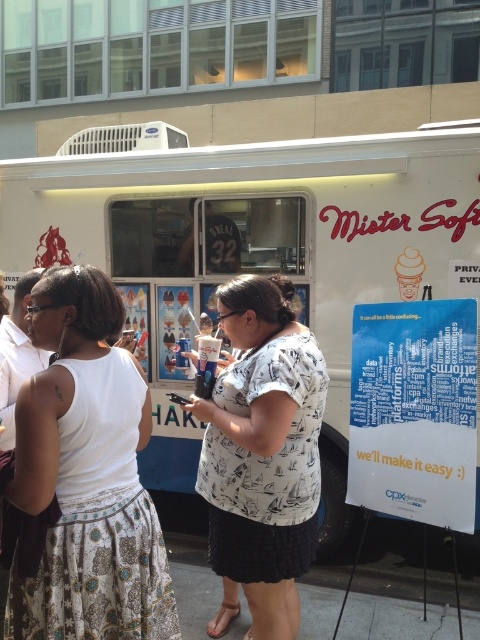
Question: Based on their relative distances, which object is farther from the white printed blouse at center?

Choices:
 (A) white printed shirt at center
 (B) white matte food truck at center

Answer: (B)

Question: Does white matte food truck at center appear over white printed shirt at center?

Choices:
 (A) yes
 (B) no

Answer: (A)

Question: Does white matte food truck at center appear under white printed blouse at center?

Choices:
 (A) no
 (B) yes

Answer: (A)

Question: Among these points, which one is nearest to the camera?

Choices:
 (A) (98, 385)
 (B) (295, 163)

Answer: (A)

Question: Which point appears closest to the camera in this image?

Choices:
 (A) (260, 195)
 (B) (181, 406)
 (C) (75, 448)

Answer: (C)

Question: Does white printed blouse at center appear on the right side of white printed shirt at center?

Choices:
 (A) no
 (B) yes

Answer: (A)